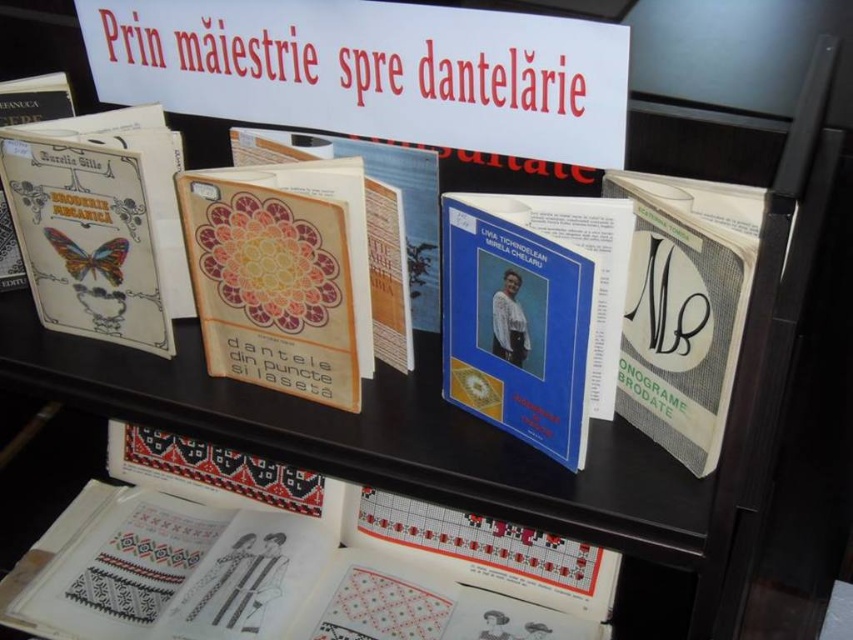
From the picture: Who is more forward, [310,580] or [4,160]?

Point [4,160]

Does white paper with black and red patterns at lower center have a lesser height compared to matte paper butterfly at left?

Indeed, white paper with black and red patterns at lower center has a lesser height compared to matte paper butterfly at left.

Is point (299, 582) behind point (148, 240)?

Yes.

Where is `white paper with black and red patterns at lower center`? The image size is (853, 640). white paper with black and red patterns at lower center is located at coordinates (247, 580).

This screenshot has height=640, width=853. What do you see at coordinates (534, 312) in the screenshot?
I see `blue hardcover book at center` at bounding box center [534, 312].

From the picture: Who is positioned more to the left, blue hardcover book at center or matte paper butterfly at left?

From the viewer's perspective, matte paper butterfly at left appears more on the left side.

Who is more forward, [486,220] or [93,134]?

Positioned in front is point [486,220].

Locate an element on the screen. blue hardcover book at center is located at coordinates (534, 312).

Is matte paper butterfly at left thinner than matte orange floral book at center?

Correct, matte paper butterfly at left's width is less than matte orange floral book at center's.

Who is lower down, matte paper butterfly at left or matte orange floral book at center?

matte orange floral book at center is lower down.

Is point (108, 296) positioned after point (337, 237)?

That is True.

The image size is (853, 640). In order to click on matte paper butterfly at left in this screenshot , I will do `click(99, 232)`.